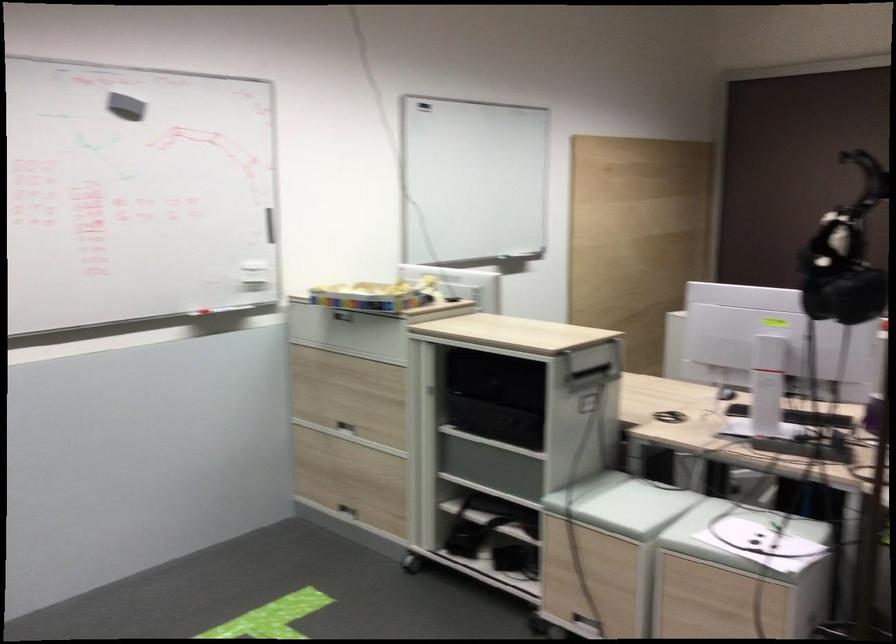
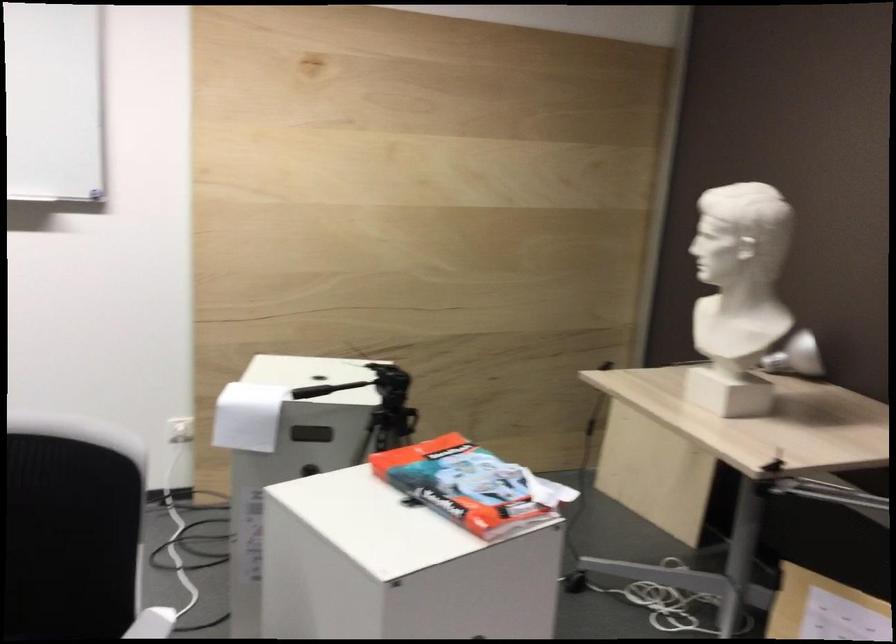
In a continuous first-person perspective shot, in which direction is the camera moving?

The movement direction of the cameraman is right, forward.